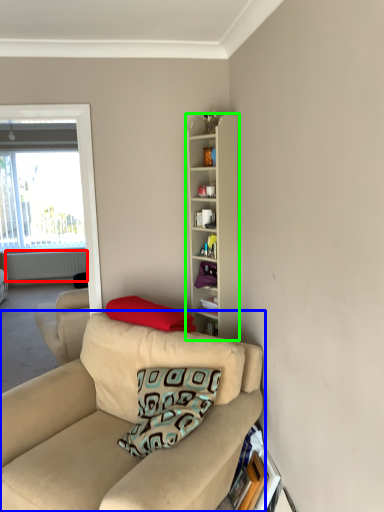
Question: Estimate the real-world distances between objects in this image. Which object is closer to radiator (highlighted by a red box), studio couch (highlighted by a blue box) or cabinetry (highlighted by a green box)?

Choices:
 (A) studio couch
 (B) cabinetry

Answer: (B)